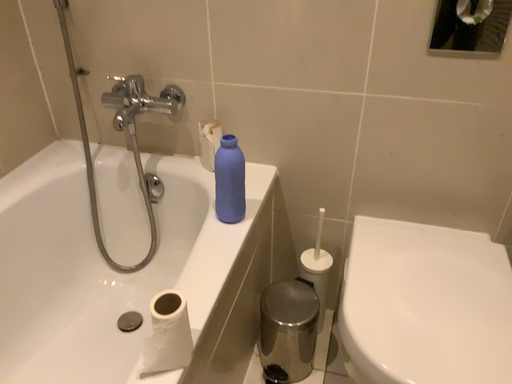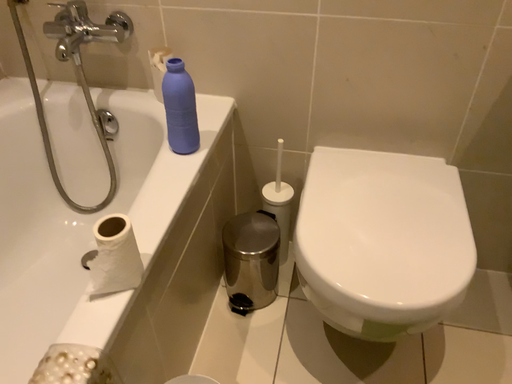
Question: How did the camera likely rotate when shooting the video?

Choices:
 (A) rotated downward
 (B) rotated upward

Answer: (A)